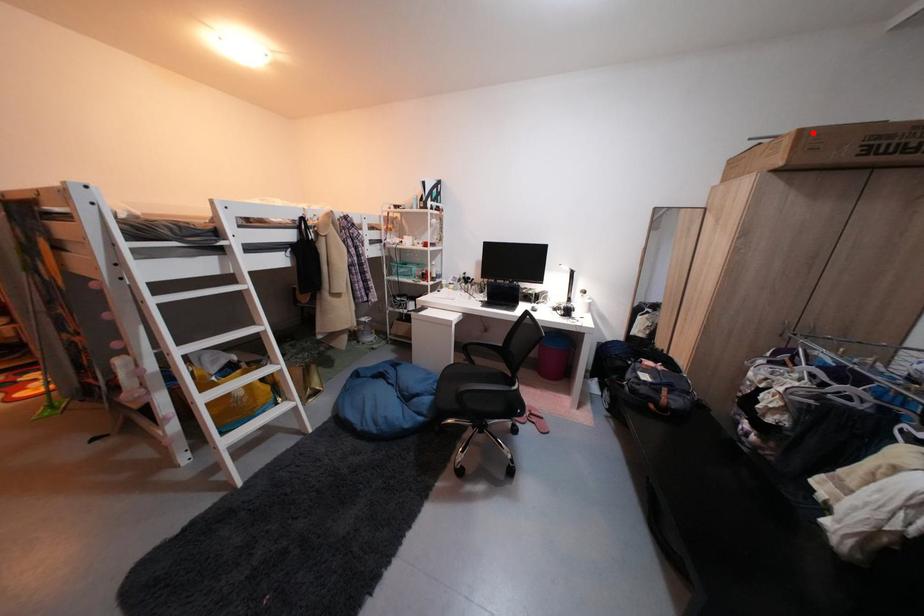
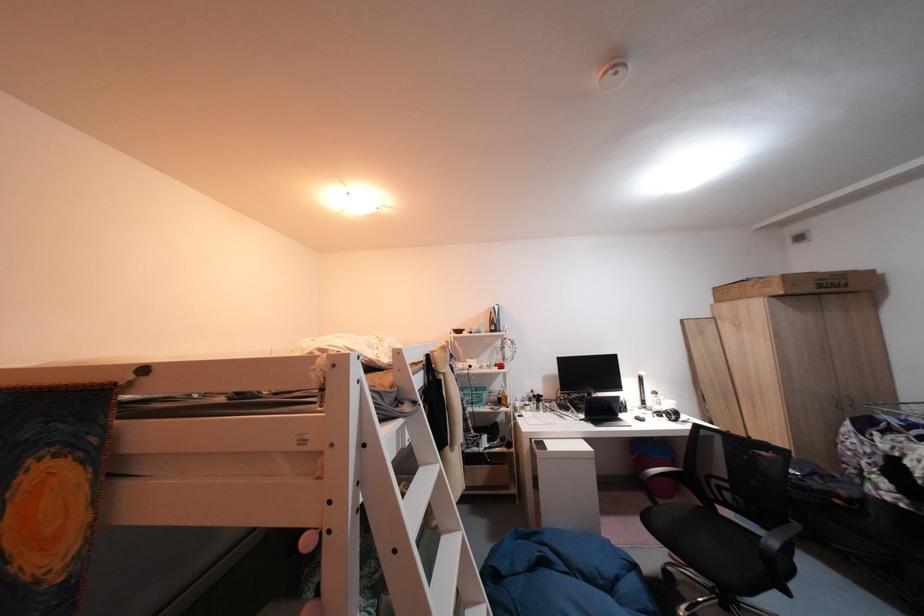
Question: I am providing you with two images of the same scene from different viewpoints. Given a red point in image1, look at the same physical point in image2. Is it:

Choices:
 (A) Closer to the viewpoint
 (B) Farther from the viewpoint

Answer: (A)